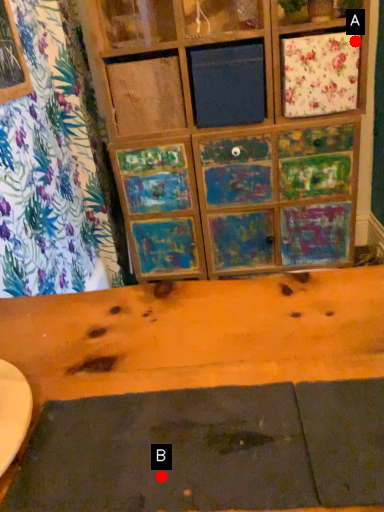
Question: Two points are circled on the image, labeled by A and B beside each circle. Which point is closer to the camera taking this photo?

Choices:
 (A) A is closer
 (B) B is closer

Answer: (B)